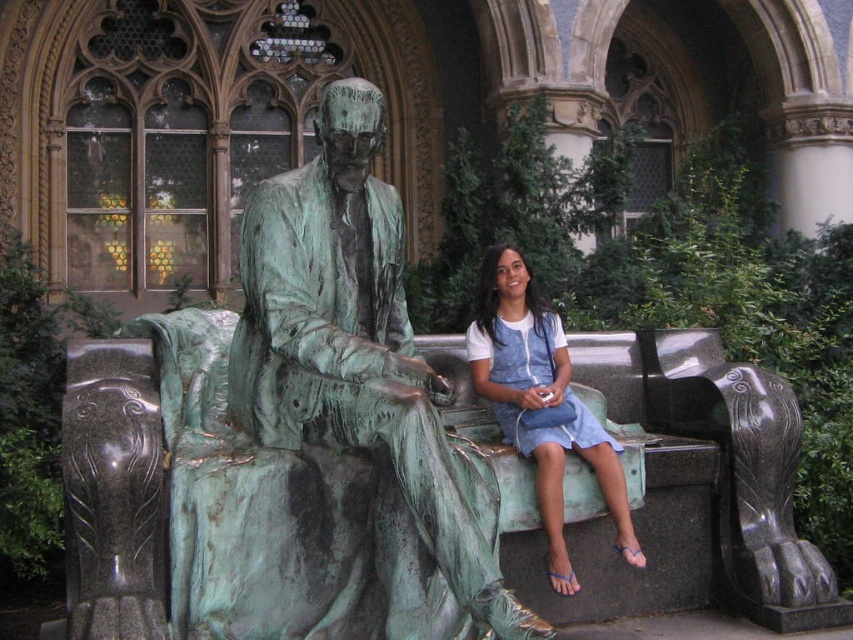
Is green patina bronze statue at center to the right of denim dress at center from the viewer's perspective?

No, green patina bronze statue at center is not to the right of denim dress at center.

Who is more forward, (440, 486) or (610, 486)?

Point (440, 486) is more forward.

I want to click on green patina bronze statue at center, so click(366, 378).